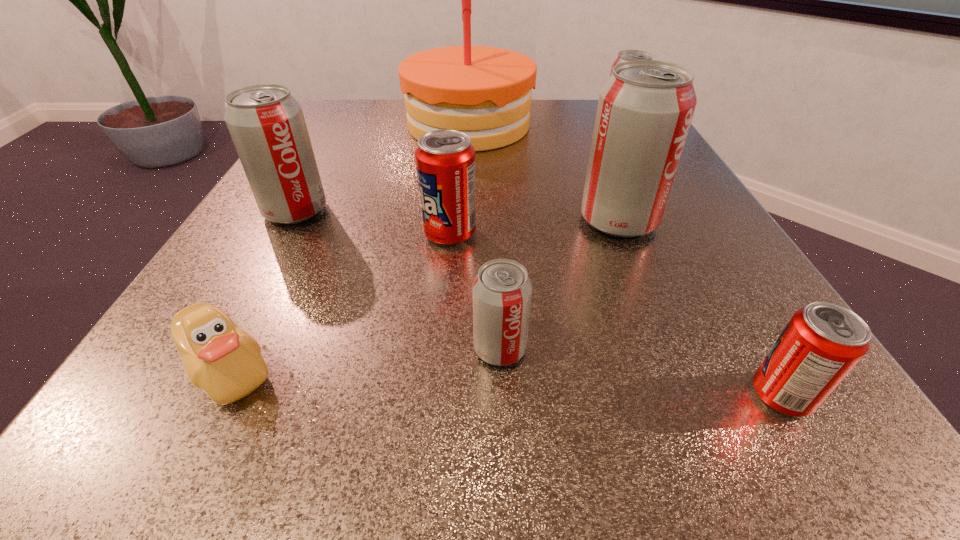
Identify the location of birthday cake. Image resolution: width=960 pixels, height=540 pixels. (485, 92).

Where is `the tallest object`? The image size is (960, 540). the tallest object is located at coordinates (485, 92).

Identify the location of the biggest gray soda can. Image resolution: width=960 pixels, height=540 pixels. (645, 109).

Identify the location of the tallest soda can. (645, 109).

Where is `the third tallest object`? This screenshot has height=540, width=960. the third tallest object is located at coordinates (266, 123).

Where is `the third smallest gray soda can`? The width and height of the screenshot is (960, 540). the third smallest gray soda can is located at coordinates (266, 123).

What are the coordinates of `the farthest gray soda can` in the screenshot? It's located at (626, 55).

Find the location of a particular element. the second smallest gray soda can is located at coordinates (626, 55).

Where is `the farther red soda can`? the farther red soda can is located at coordinates (445, 160).

This screenshot has width=960, height=540. Identify the location of the left red soda can. (445, 160).